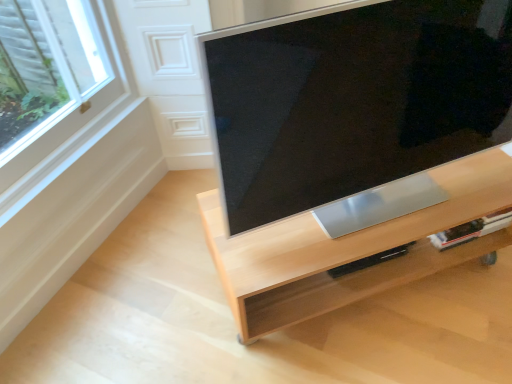
Question: Can you confirm if light wood tv stand at center is taller than satin silver tv at center?

Choices:
 (A) yes
 (B) no

Answer: (B)

Question: Is satin silver tv at center completely or partially inside light wood tv stand at center?

Choices:
 (A) no
 (B) yes

Answer: (A)

Question: Is light wood tv stand at center at the right side of satin silver tv at center?

Choices:
 (A) yes
 (B) no

Answer: (B)

Question: From the image's perspective, is light wood tv stand at center on top of satin silver tv at center?

Choices:
 (A) no
 (B) yes

Answer: (A)

Question: Can we say light wood tv stand at center lies outside satin silver tv at center?

Choices:
 (A) no
 (B) yes

Answer: (B)

Question: Does light wood tv stand at center lie in front of satin silver tv at center?

Choices:
 (A) no
 (B) yes

Answer: (A)

Question: Are satin silver tv at center and light wood tv stand at center beside each other?

Choices:
 (A) no
 (B) yes

Answer: (A)

Question: Can you confirm if satin silver tv at center is positioned to the right of light wood tv stand at center?

Choices:
 (A) no
 (B) yes

Answer: (B)

Question: Can you confirm if satin silver tv at center is smaller than light wood tv stand at center?

Choices:
 (A) no
 (B) yes

Answer: (B)

Question: From the image's perspective, is satin silver tv at center under light wood tv stand at center?

Choices:
 (A) no
 (B) yes

Answer: (A)

Question: Is light wood tv stand at center completely or partially inside satin silver tv at center?

Choices:
 (A) yes
 (B) no

Answer: (B)

Question: Considering the relative sizes of satin silver tv at center and light wood tv stand at center in the image provided, is satin silver tv at center bigger than light wood tv stand at center?

Choices:
 (A) no
 (B) yes

Answer: (A)

Question: From their relative heights in the image, would you say light wood tv stand at center is taller or shorter than satin silver tv at center?

Choices:
 (A) tall
 (B) short

Answer: (B)